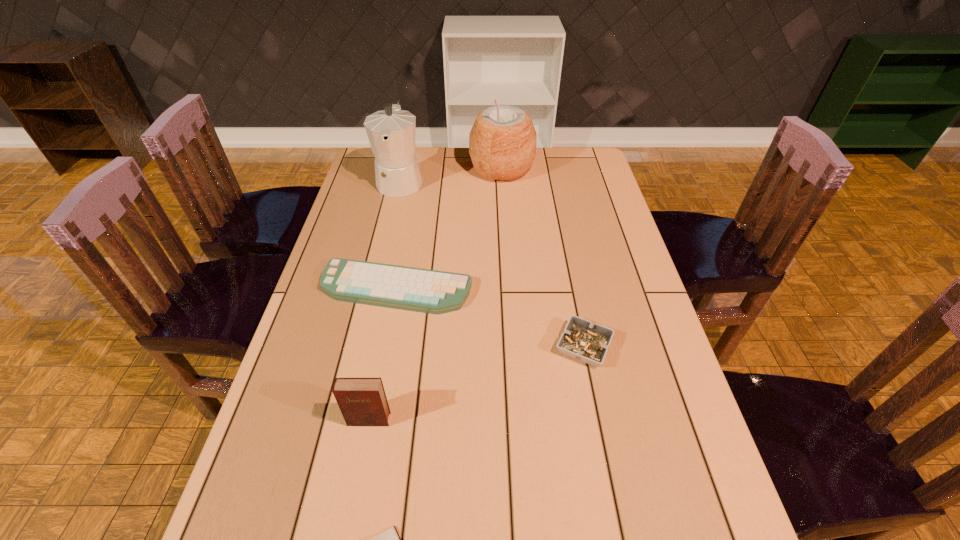
The width and height of the screenshot is (960, 540). What are the coordinates of `coffeepot` in the screenshot? It's located at (391, 132).

Where is `coconut`? Image resolution: width=960 pixels, height=540 pixels. coconut is located at coordinates 502,142.

Locate an element on the screen. The width and height of the screenshot is (960, 540). the taller diary is located at coordinates (362, 401).

Image resolution: width=960 pixels, height=540 pixels. I want to click on the fifth farthest object, so click(x=362, y=401).

This screenshot has height=540, width=960. What are the coordinates of `ashtray` in the screenshot? It's located at (588, 342).

The image size is (960, 540). What are the coordinates of `computer keyboard` in the screenshot? It's located at (428, 291).

Image resolution: width=960 pixels, height=540 pixels. Find the location of `the second shortest object`. the second shortest object is located at coordinates (428, 291).

Where is `free space located at the spout of the coffeepot`? This screenshot has width=960, height=540. free space located at the spout of the coffeepot is located at coordinates (382, 261).

This screenshot has height=540, width=960. Find the location of `blank space located on the left of the coconut`. blank space located on the left of the coconut is located at coordinates (373, 169).

This screenshot has width=960, height=540. Find the location of `vacant space located 0.200m on the front cover of the farther diary`. vacant space located 0.200m on the front cover of the farther diary is located at coordinates (348, 531).